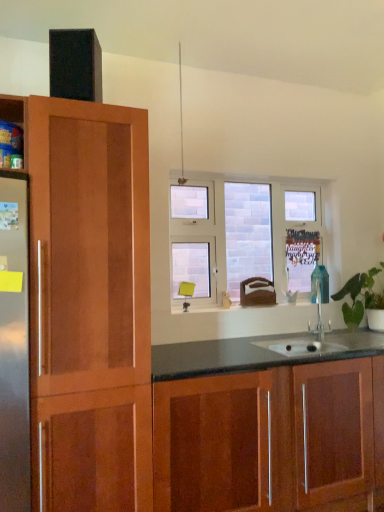
Question: Can you confirm if clear glass window at center is taller than green leafy plant at right?

Choices:
 (A) yes
 (B) no

Answer: (A)

Question: Is clear glass window at center wider than green leafy plant at right?

Choices:
 (A) yes
 (B) no

Answer: (B)

Question: Does clear glass window at center turn towards green leafy plant at right?

Choices:
 (A) no
 (B) yes

Answer: (B)

Question: Is clear glass window at center looking in the opposite direction of green leafy plant at right?

Choices:
 (A) yes
 (B) no

Answer: (B)

Question: Is clear glass window at center far away from green leafy plant at right?

Choices:
 (A) no
 (B) yes

Answer: (A)

Question: From the image's perspective, would you say clear glass window at center is shown under green leafy plant at right?

Choices:
 (A) no
 (B) yes

Answer: (A)

Question: Is glossy wood cabinets at lower center shorter than clear glass window at center?

Choices:
 (A) no
 (B) yes

Answer: (B)

Question: From the image's perspective, is glossy wood cabinets at lower center over clear glass window at center?

Choices:
 (A) yes
 (B) no

Answer: (B)

Question: From a real-world perspective, is glossy wood cabinets at lower center on clear glass window at center?

Choices:
 (A) yes
 (B) no

Answer: (B)

Question: Is glossy wood cabinets at lower center facing towards clear glass window at center?

Choices:
 (A) no
 (B) yes

Answer: (A)

Question: Is glossy wood cabinets at lower center positioned in front of clear glass window at center?

Choices:
 (A) yes
 (B) no

Answer: (A)

Question: Can you confirm if glossy wood cabinets at lower center is wider than clear glass window at center?

Choices:
 (A) yes
 (B) no

Answer: (A)

Question: Is clear glass window at center positioned behind glossy wood cabinets at lower center?

Choices:
 (A) yes
 (B) no

Answer: (A)